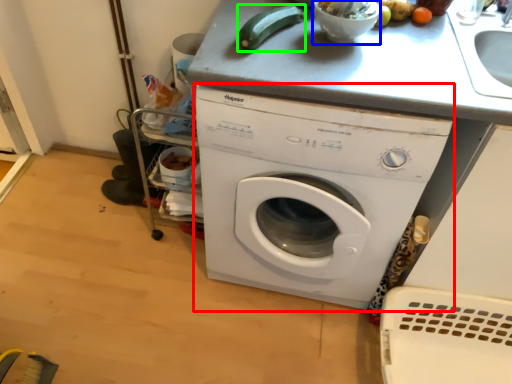
Question: Which object is the farthest from washing machine (highlighted by a red box)? Choose among these: mixing bowl (highlighted by a blue box) or vegetable (highlighted by a green box).

Choices:
 (A) mixing bowl
 (B) vegetable

Answer: (A)